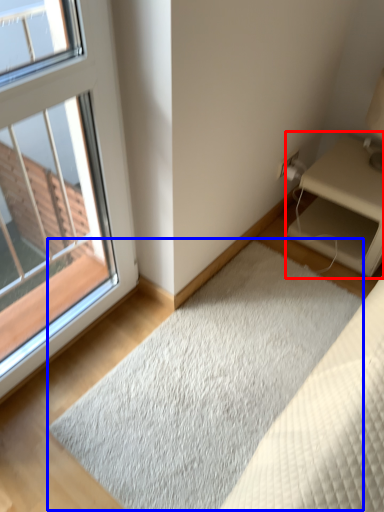
Question: Which object appears closest to the camera in this image, nightstand (highlighted by a red box) or doormat (highlighted by a blue box)?

Choices:
 (A) nightstand
 (B) doormat

Answer: (B)